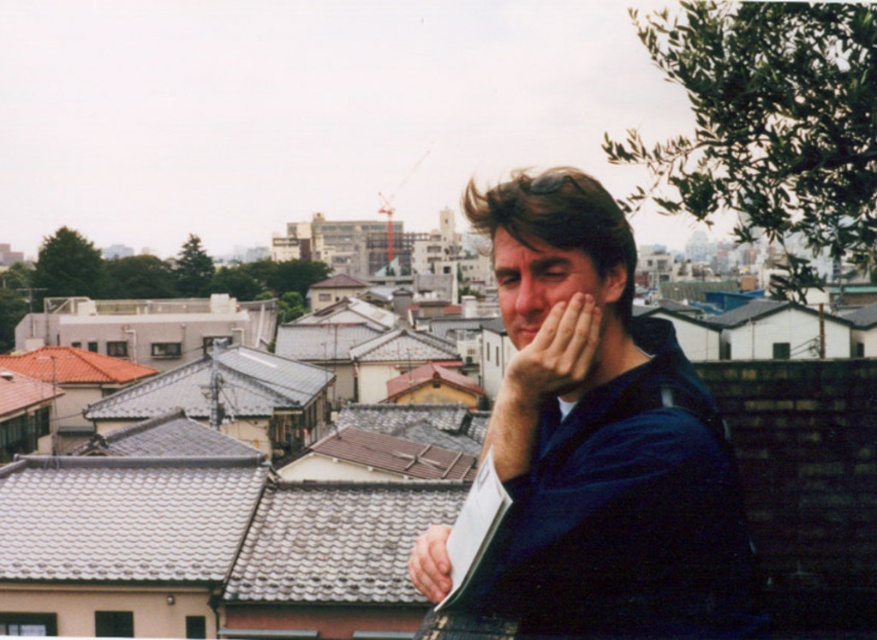
You are a fashion designer observing the man in the scene. You need to determine if the dark blue shirt at center can be replaced with a wider version without overlapping the smooth skin face at center. Is this possible?

The dark blue shirt at center might be wider than smooth skin face at center, so replacing it with a wider version could cause overlap with the smooth skin face at center, making it not advisable.

From the picture: You are a photographer trying to focus on two specific points in the image. The first point is at coordinate point (531, 403) and the second is at point (418, 572). Which point should you adjust your focus to first if you want to capture the closest object to the camera?

Point (531, 403) is closer to the camera than point (418, 572), so you should adjust your focus to point (531, 403) first to capture the closest object.